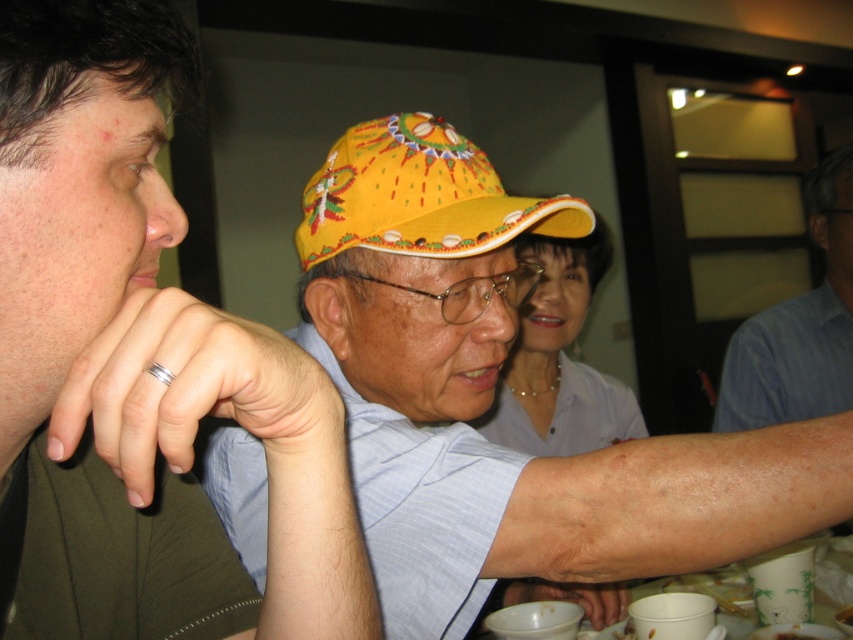
Question: Among these points, which one is nearest to the camera?

Choices:
 (A) (114, 339)
 (B) (251, 440)
 (C) (840, 330)
 (D) (485, 636)

Answer: (A)

Question: Which of the following is the closest to the observer?

Choices:
 (A) (309, 236)
 (B) (543, 337)
 (C) (149, 592)

Answer: (C)

Question: In this image, where is smooth white blouse at center located relative to white paper cups at lower center?

Choices:
 (A) above
 (B) below

Answer: (A)

Question: Is yellow fabric cap at center in front of blue striped shirt at right?

Choices:
 (A) no
 (B) yes

Answer: (B)

Question: From the image, what is the correct spatial relationship of yellow fabric cap at center in relation to white paper cups at lower center?

Choices:
 (A) below
 (B) above

Answer: (B)

Question: Which point appears closest to the camera in this image?

Choices:
 (A) (550, 429)
 (B) (762, 342)
 (C) (492, 576)
 (D) (105, 387)

Answer: (D)